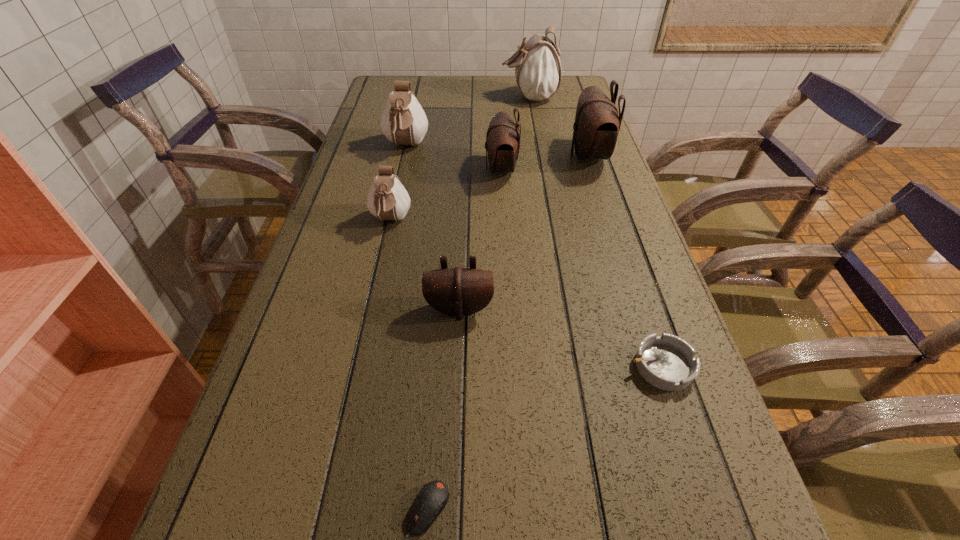
In order to click on the seventh tallest object in this screenshot , I will do `click(667, 362)`.

Where is `free point located 0.400m on the front-facing side of the biggest white pouch`? free point located 0.400m on the front-facing side of the biggest white pouch is located at coordinates (389, 97).

Locate an element on the screen. vacant space located on the front-facing side of the biggest white pouch is located at coordinates (484, 97).

Where is `vacant region located 0.050m on the front-facing side of the biggest white pouch`? The image size is (960, 540). vacant region located 0.050m on the front-facing side of the biggest white pouch is located at coordinates (487, 97).

The height and width of the screenshot is (540, 960). In order to click on vacant space situated 0.360m with the flap open on the rightmost brown pouch in this screenshot , I will do `click(446, 156)`.

Find the location of `free space located 0.200m with the flap open on the rightmost brown pouch`. free space located 0.200m with the flap open on the rightmost brown pouch is located at coordinates (500, 156).

Locate an element on the screen. vacant area situated 0.280m with the flap open on the rightmost brown pouch is located at coordinates pos(473,156).

I want to click on vacant area situated on the front-facing side of the second farthest white pouch, so click(x=382, y=253).

You are a GUI agent. You are given a task and a screenshot of the screen. Output one action in this format:
    pyautogui.click(x=<x>, y=<y>)
    Task: Click on the vacant region located with the flap open on the second smallest brown pouch
    Image resolution: width=960 pixels, height=540 pixels.
    Given the screenshot: What is the action you would take?
    pyautogui.click(x=374, y=169)

The width and height of the screenshot is (960, 540). Find the location of `vacant region located 0.310m with the flap open on the second smallest brown pouch`. vacant region located 0.310m with the flap open on the second smallest brown pouch is located at coordinates (374, 169).